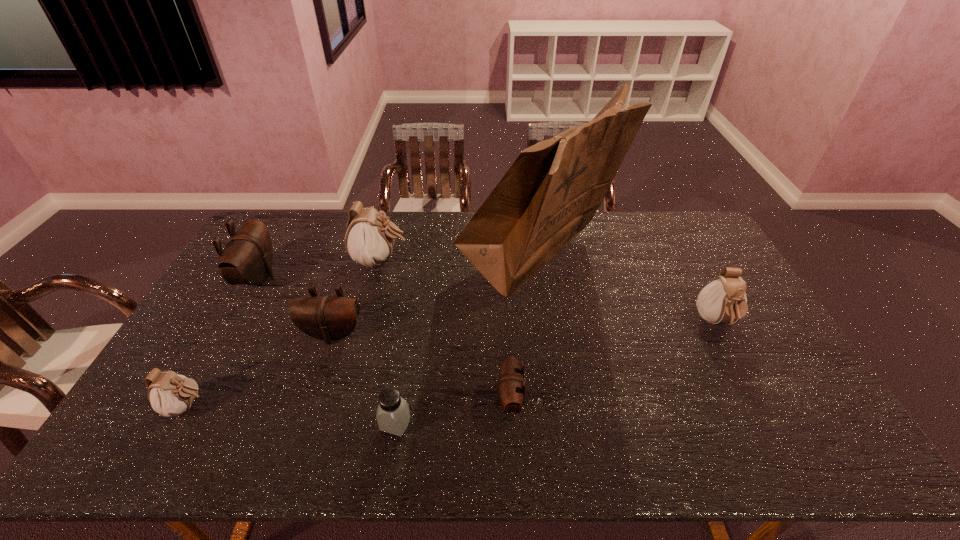
You are a GUI agent. You are given a task and a screenshot of the screen. Output one action in this format:
    pyautogui.click(x=<x>, y=<y>)
    Task: Click on the grocery bag
    The height and width of the screenshot is (540, 960).
    Given the screenshot: What is the action you would take?
    pyautogui.click(x=550, y=193)

Where is `the tallest object`? The height and width of the screenshot is (540, 960). the tallest object is located at coordinates (550, 193).

Locate an element on the screen. The height and width of the screenshot is (540, 960). the second white pouch from right to left is located at coordinates (369, 240).

Where is `the biggest white pouch`? the biggest white pouch is located at coordinates [369, 240].

Where is `the leftmost brown pouch`? The height and width of the screenshot is (540, 960). the leftmost brown pouch is located at coordinates 247,258.

The height and width of the screenshot is (540, 960). Find the location of `the farthest brown pouch`. the farthest brown pouch is located at coordinates (247, 258).

Locate an element on the screen. the rightmost object is located at coordinates (723, 300).

This screenshot has width=960, height=540. I want to click on the second biggest white pouch, so click(723, 300).

The image size is (960, 540). Identify the location of the second nearest brown pouch. (328, 318).

You are a GUI agent. You are given a task and a screenshot of the screen. Output one action in this format:
    pyautogui.click(x=<x>, y=<y>)
    Task: Click on the second biggest brown pouch
    This screenshot has width=960, height=540.
    Given the screenshot: What is the action you would take?
    pyautogui.click(x=328, y=318)